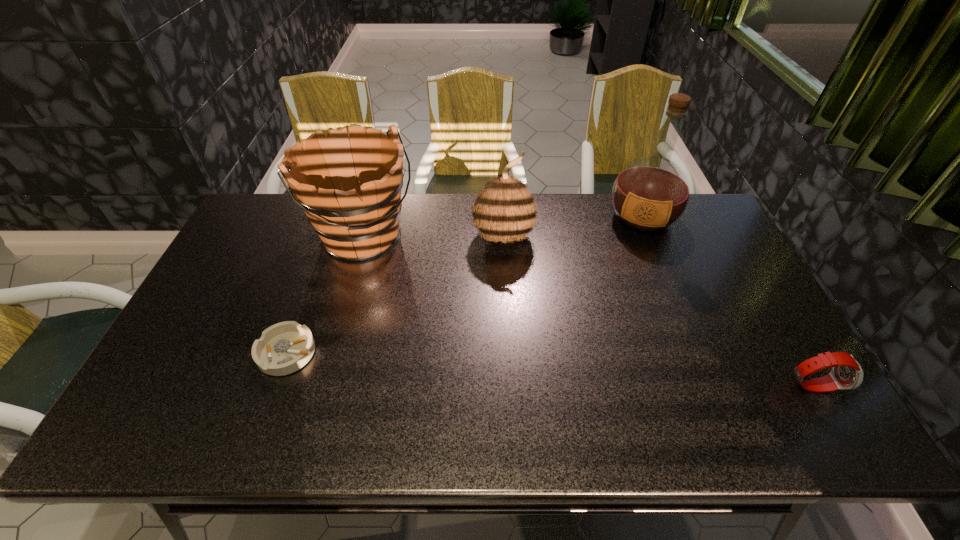
Where is `vacant space located 0.230m on the surface of the third object from left to right`? The height and width of the screenshot is (540, 960). vacant space located 0.230m on the surface of the third object from left to right is located at coordinates (553, 309).

Find the location of a particular element. vacant space positioned 0.140m on the front label of the liquor is located at coordinates (632, 268).

Find the location of `free point located 0.100m on the front label of the liquor`. free point located 0.100m on the front label of the liquor is located at coordinates pyautogui.click(x=634, y=260).

You are a GUI agent. You are given a task and a screenshot of the screen. Output one action in this format:
    pyautogui.click(x=<x>, y=<y>)
    Task: Click on the vacant space positioned 0.390m on the front label of the liquor
    Image resolution: width=960 pixels, height=540 pixels.
    Given the screenshot: What is the action you would take?
    pyautogui.click(x=618, y=330)

I want to click on vacant space located 0.240m with the handle on the wine bucket, so click(433, 316).

This screenshot has width=960, height=540. In order to click on vacant space situated 0.200m with the handle on the wine bucket in this screenshot , I will do click(x=425, y=307).

I want to click on free region located with the handle on the wine bucket, so click(x=405, y=285).

Identify the location of coconut that is at the far edge. (504, 210).

Where is `liquor present at the far edge`? The image size is (960, 540). liquor present at the far edge is located at coordinates (650, 194).

Identify the location of wine bucket that is positioned at the far edge. The width and height of the screenshot is (960, 540). (349, 187).